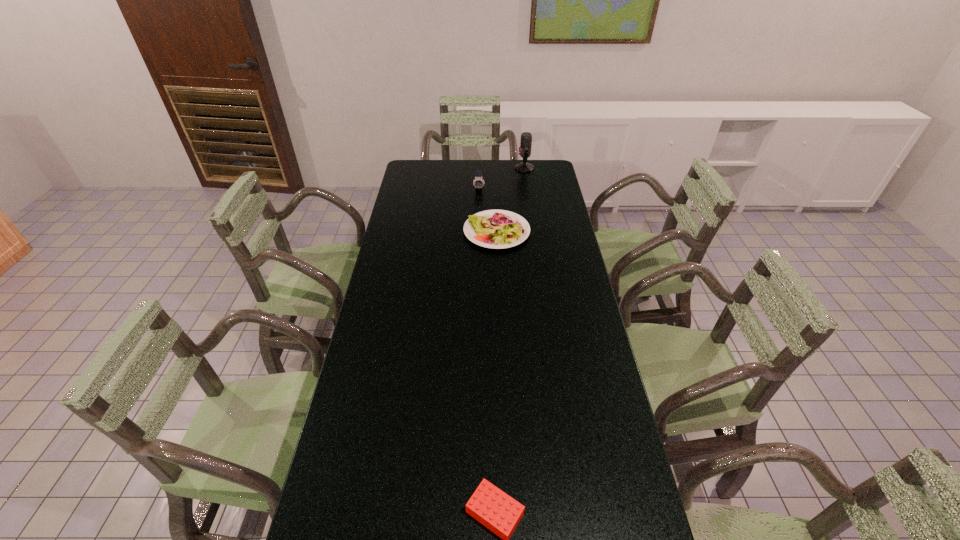
Image resolution: width=960 pixels, height=540 pixels. I want to click on the tallest object, so point(526,138).

You are a GUI agent. You are given a task and a screenshot of the screen. Output one action in this format:
    pyautogui.click(x=<x>, y=<y>)
    Task: Click on the farthest object
    The height and width of the screenshot is (540, 960).
    Given the screenshot: What is the action you would take?
    pyautogui.click(x=526, y=138)

Find the location of a particular element. This screenshot has width=960, height=540. the third shortest object is located at coordinates (478, 182).

Locate an element on the screen. the second farthest object is located at coordinates (478, 182).

In order to click on the third tallest object in this screenshot , I will do `click(497, 229)`.

Identify the location of salad plate. (497, 229).

Find the location of a particular element. Image resolution: width=960 pixels, height=540 pixels. free space located on the side of the farthest object with the red ring is located at coordinates (487, 168).

I want to click on free spot located on the side of the farthest object with the red ring, so click(x=457, y=168).

Identify the location of blank space located 0.320m on the side of the farthest object with the red ring. The width and height of the screenshot is (960, 540). (450, 168).

Identify the location of free spot located on the face of the third nearest object. The height and width of the screenshot is (540, 960). (479, 201).